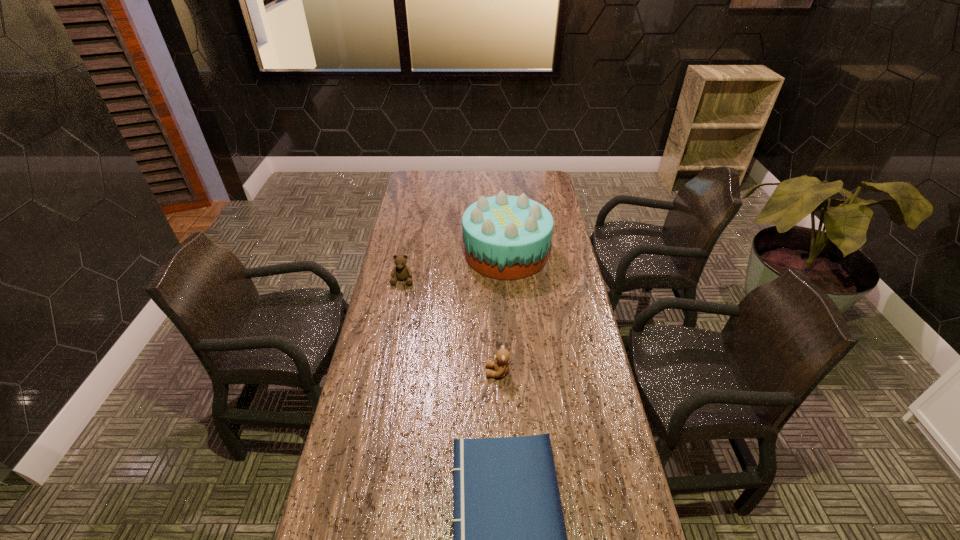
The image size is (960, 540). Identify the location of object at the left edge. (402, 272).

Where is `object located at the right edge`? This screenshot has width=960, height=540. object located at the right edge is located at coordinates (506, 237).

You are a GUI agent. You are given a task and a screenshot of the screen. Output one action in this format:
    pyautogui.click(x=<x>, y=<y>)
    Task: Click on the vacant space at the far edge of the desktop
    
    Given the screenshot: What is the action you would take?
    click(x=447, y=181)

At what (x,y) coordinates should I click in order to perform the action: click on free region at the left edge of the desktop. Please return your answer as a coordinate pair (x, y). This screenshot has height=540, width=960. Looking at the image, I should click on (395, 472).

In the image, there is a desktop. Where is `free region at the right edge`? free region at the right edge is located at coordinates (566, 288).

In the image, there is a desktop. At what (x,y) coordinates should I click in order to perform the action: click on vacant space at the far right corner. Please return your answer as a coordinate pair (x, y). The width and height of the screenshot is (960, 540). Looking at the image, I should click on (549, 181).

This screenshot has width=960, height=540. I want to click on vacant point located between the tallest object and the farther teddy bear, so click(x=454, y=267).

You are a GUI agent. You are given a task and a screenshot of the screen. Output one action in this format:
    pyautogui.click(x=<x>, y=<y>)
    Task: Click on the vacant space that is in between the right teddy bear and the left teddy bear
    The height and width of the screenshot is (540, 960).
    Given the screenshot: What is the action you would take?
    pyautogui.click(x=450, y=326)

The width and height of the screenshot is (960, 540). In order to click on vacant space that is in between the nearer teddy bear and the tallest object in this screenshot , I will do `click(502, 313)`.

Locate an element on the screen. free space between the tallest object and the farther teddy bear is located at coordinates (454, 267).